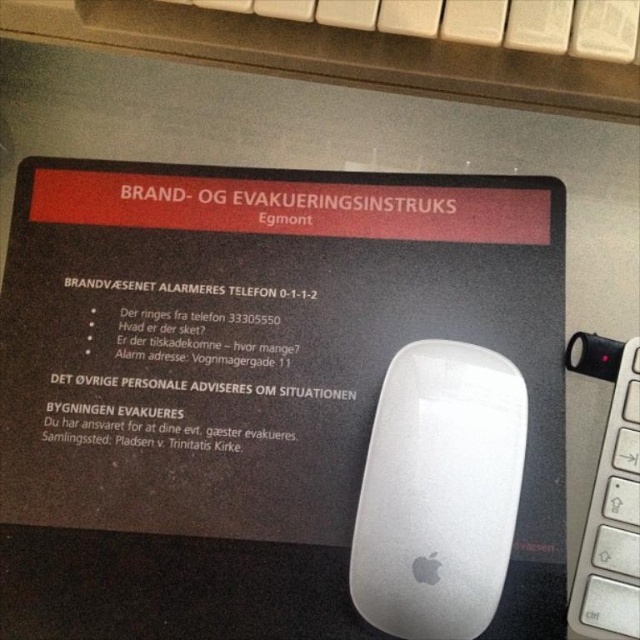
You are setting up a workstation and need to place the white matte mouse at center and the white plastic keyboard at right. Based on their positions, which object is closer to you?

The white matte mouse at center is closer to you because it is further to the viewer than the white plastic keyboard at right.

You are setting up a computer workstation and have to place the white matte mouse at center and the white plastic keyboard at right. Which object requires more desk space due to its size?

The white matte mouse at center is larger in size than the white plastic keyboard at right, so it requires more desk space.